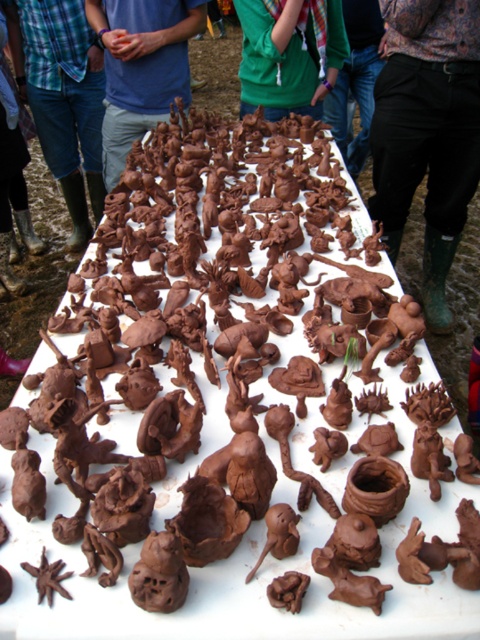
Measure the distance from green rubber boots at lower right to green rubber boots at left.

5.73 feet

What do you see at coordinates (428, 131) in the screenshot? The width and height of the screenshot is (480, 640). I see `green rubber boots at lower right` at bounding box center [428, 131].

The height and width of the screenshot is (640, 480). In order to click on green rubber boots at lower right in this screenshot , I will do `click(428, 131)`.

Is green rubber boots at lower right shorter than blue matte shirt at upper center?

No, green rubber boots at lower right is not shorter than blue matte shirt at upper center.

Locate an element on the screen. green rubber boots at lower right is located at coordinates (428, 131).

What do you see at coordinates (289, 52) in the screenshot?
I see `green matte sweater at center` at bounding box center [289, 52].

Can you confirm if green matte sweater at center is positioned below green matte shirt at upper center?

Yes.

Who is more forward, (297,16) or (342,128)?

Point (297,16) is in front.

The image size is (480, 640). Find the location of `green matte sweater at center`. green matte sweater at center is located at coordinates (289, 52).